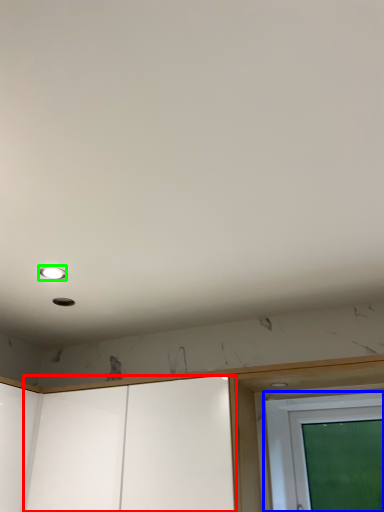
Question: Which object is positioned farthest from screen door (highlighted by a red box)? Select from screen door (highlighted by a blue box) and droplight (highlighted by a green box).

Choices:
 (A) screen door
 (B) droplight

Answer: (B)